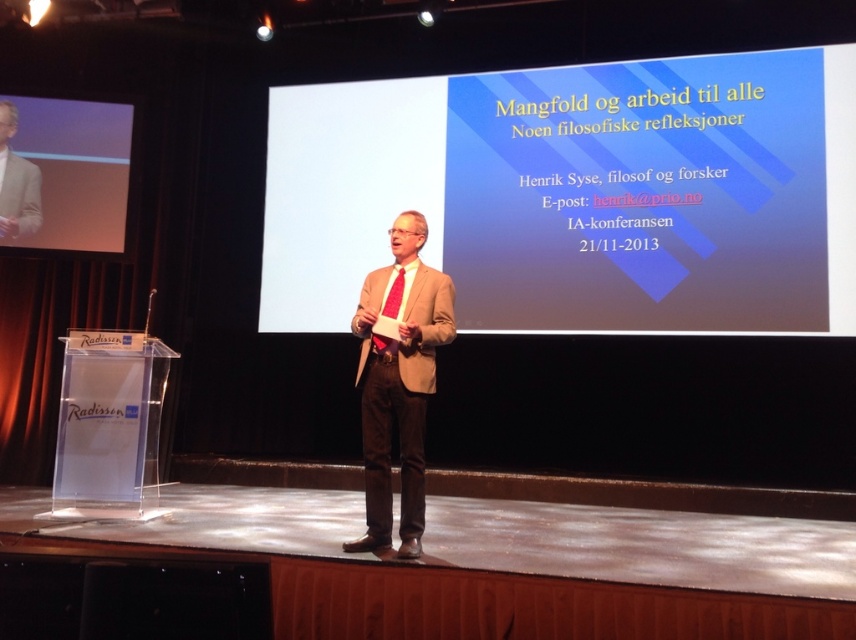
Question: Among these points, which one is farthest from the camera?

Choices:
 (A) pyautogui.click(x=376, y=531)
 (B) pyautogui.click(x=684, y=259)

Answer: (B)

Question: Is light brown suit at left closer to camera compared to matte red tie at center?

Choices:
 (A) no
 (B) yes

Answer: (A)

Question: Which object is closer to the camera taking this photo?

Choices:
 (A) matte black screen at upper left
 (B) matte brown suit at center
 (C) blue gradient screen at center
 (D) matte red tie at center

Answer: (B)

Question: Which of the following is the closest to the observer?

Choices:
 (A) (396, 292)
 (B) (22, 164)

Answer: (A)

Question: From the image, what is the correct spatial relationship of matte black screen at upper left in relation to light brown suit at left?

Choices:
 (A) above
 (B) below

Answer: (B)

Question: Can you confirm if blue gradient screen at center is positioned below light brown suit at left?

Choices:
 (A) no
 (B) yes

Answer: (B)